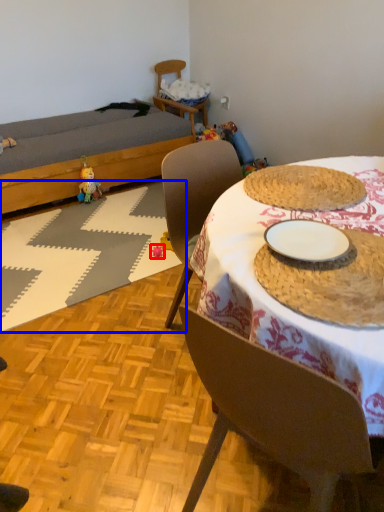
Question: Which object is further to the camera taking this photo, toy (highlighted by a red box) or place mat (highlighted by a blue box)?

Choices:
 (A) toy
 (B) place mat

Answer: (A)